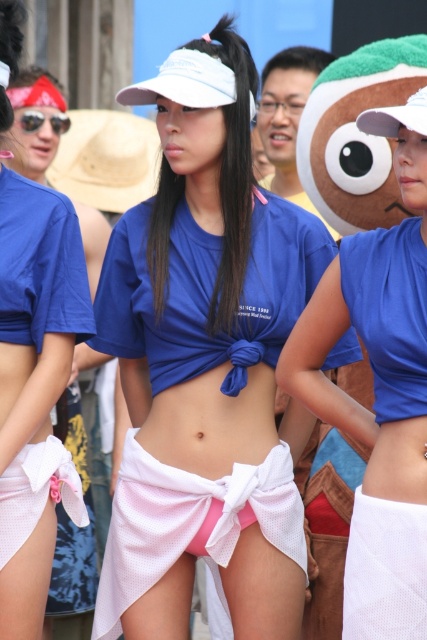
Is matte blue shirt at center below pink mesh underwear at center?

No.

Between matte blue shirt at center and pink mesh underwear at center, which one appears on the left side from the viewer's perspective?

From the viewer's perspective, matte blue shirt at center appears more on the left side.

Locate an element on the screen. The width and height of the screenshot is (427, 640). matte blue shirt at center is located at coordinates (35, 314).

Between pink mesh underwear at center and pink mesh underwear at lower left, which one has less height?

pink mesh underwear at lower left is shorter.

Which is behind, point (149, 531) or point (28, 508)?

The point (149, 531) is behind.

Between point (175, 490) and point (23, 531), which one is positioned in front?

Positioned in front is point (23, 531).

This screenshot has height=640, width=427. What are the coordinates of `pink mesh underwear at center` in the screenshot? It's located at (190, 524).

Where is `matte blue t-shirt at center`? The height and width of the screenshot is (640, 427). matte blue t-shirt at center is located at coordinates pos(204,364).

This screenshot has width=427, height=640. Describe the element at coordinates (204, 364) in the screenshot. I see `matte blue t-shirt at center` at that location.

Is point (192, 577) in front of point (424, 612)?

No, (192, 577) is further to viewer.

Image resolution: width=427 pixels, height=640 pixels. Identify the location of matte blue t-shirt at center. [x=204, y=364].